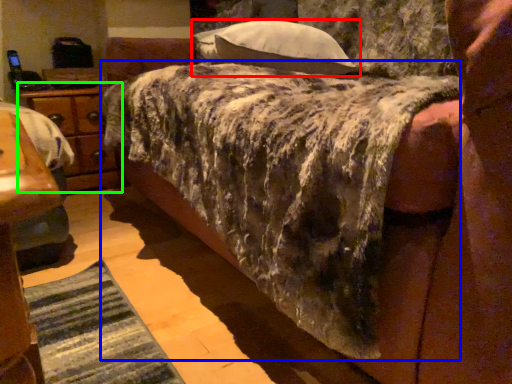
Question: Considering the real-world distances, which object is closest to pillow (highlighted by a red box)? mattress (highlighted by a blue box) or nightstand (highlighted by a green box).

Choices:
 (A) mattress
 (B) nightstand

Answer: (A)